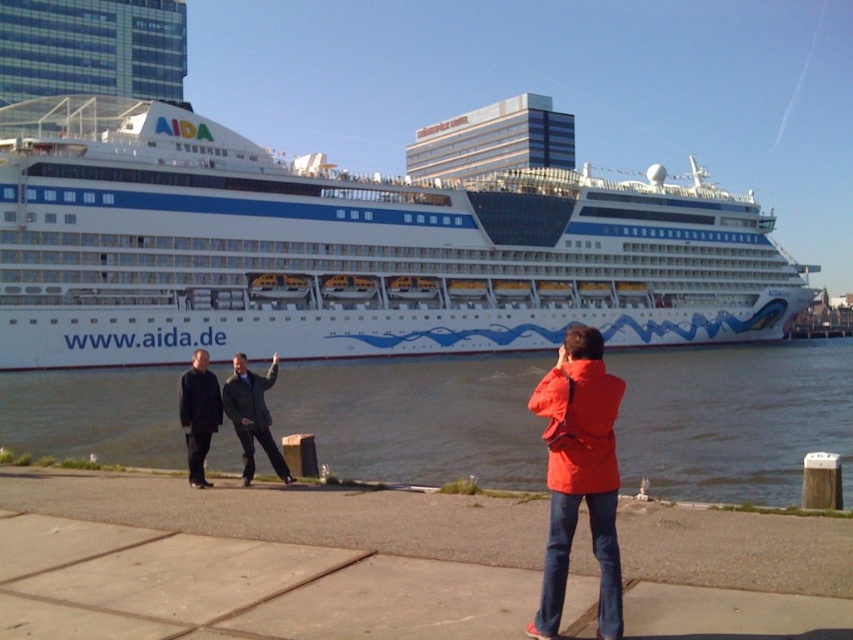
Is point (563, 532) less distant than point (178, 404)?

Yes, it is.

Can you confirm if matte red jacket at lower right is bigger than dark gray suit at center?

Indeed, matte red jacket at lower right has a larger size compared to dark gray suit at center.

Does point (560, 442) come closer to viewer compared to point (196, 477)?

Yes, it is.

Identify the location of matte red jacket at lower right. (579, 476).

Is dark gray wool coat at center smaller than dark gray suit at center?

Yes, dark gray wool coat at center is smaller than dark gray suit at center.

Describe the element at coordinates (252, 416) in the screenshot. The width and height of the screenshot is (853, 640). I see `dark gray wool coat at center` at that location.

You are a GUI agent. You are given a task and a screenshot of the screen. Output one action in this format:
    pyautogui.click(x=<x>, y=<y>)
    Task: Click on the dark gray wool coat at center
    
    Given the screenshot: What is the action you would take?
    pyautogui.click(x=252, y=416)

Is the position of white glossy cruise ship at center less distant than that of dark gray wool coat at center?

No.

Who is positioned more to the right, white glossy cruise ship at center or dark gray wool coat at center?

Positioned to the right is white glossy cruise ship at center.

Between point (270, 269) and point (267, 417), which one is positioned behind?

Positioned behind is point (270, 269).

Where is `white glossy cruise ship at center`? The height and width of the screenshot is (640, 853). white glossy cruise ship at center is located at coordinates (347, 250).